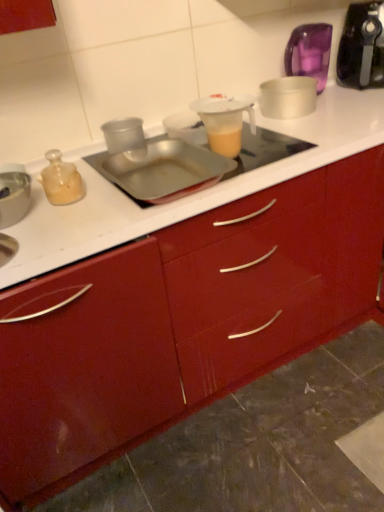
Locate an element on the screen. The image size is (384, 512). transparent plastic cup at center, which is counted as the 2th appliance, starting from the front is located at coordinates (126, 137).

The height and width of the screenshot is (512, 384). What do you see at coordinates (225, 121) in the screenshot?
I see `translucent plastic pitcher at center` at bounding box center [225, 121].

The image size is (384, 512). In order to click on black plastic blender at upper right in this screenshot , I will do `click(362, 47)`.

Considering the sizes of objects translucent purple container at upper right, positioned as the first appliance in right-to-left order, and black plastic blender at upper right in the image provided, who is thinner, translucent purple container at upper right, positioned as the first appliance in right-to-left order, or black plastic blender at upper right?

translucent purple container at upper right, positioned as the first appliance in right-to-left order, is thinner.

Is translucent purple container at upper right, acting as the first appliance starting from the top, with black plastic blender at upper right?

translucent purple container at upper right, acting as the first appliance starting from the top, and black plastic blender at upper right are not in contact.

Consider the image. Can we say translucent purple container at upper right, positioned as the first appliance in right-to-left order, lies outside black plastic blender at upper right?

Yes, translucent purple container at upper right, positioned as the first appliance in right-to-left order, is not within black plastic blender at upper right.

Looking at this image, is transparent plastic cup at center, acting as the second appliance starting from the bottom, to the left or to the right of white plastic container at upper right, the second appliance when ordered from top to bottom, in the image?

From the image, it's evident that transparent plastic cup at center, acting as the second appliance starting from the bottom, is to the left of white plastic container at upper right, the second appliance when ordered from top to bottom.

Locate an element on the screen. The width and height of the screenshot is (384, 512). the 1st appliance behind the transparent plastic cup at center, acting as the second appliance starting from the bottom, starting your count from the anchor is located at coordinates (288, 97).

In the scene shown: Does transparent plastic cup at center, acting as the third appliance starting from the back, contain white plastic container at upper right, the second appliance positioned from the right?

Definitely not — white plastic container at upper right, the second appliance positioned from the right, is not inside transparent plastic cup at center, acting as the third appliance starting from the back.

Does transparent plastic cup at center, which is counted as the 2th appliance, starting from the front, have a greater width compared to white plastic container at upper right, the second appliance when ordered from top to bottom?

Incorrect, the width of transparent plastic cup at center, which is counted as the 2th appliance, starting from the front, does not surpass that of white plastic container at upper right, the second appliance when ordered from top to bottom.

Considering the sizes of objects transparent plastic cup at center, acting as the third appliance starting from the back, and glossy red cabinet at center in the image provided, who is shorter, transparent plastic cup at center, acting as the third appliance starting from the back, or glossy red cabinet at center?

transparent plastic cup at center, acting as the third appliance starting from the back, is shorter.

Are transparent plastic cup at center, which is the third appliance in right-to-left order, and glossy red cabinet at center beside each other?

No, transparent plastic cup at center, which is the third appliance in right-to-left order, is not next to glossy red cabinet at center.

Is transparent plastic cup at center, placed as the third appliance when sorted from top to bottom, outside of glossy red cabinet at center?

Yes, transparent plastic cup at center, placed as the third appliance when sorted from top to bottom, is located beyond the bounds of glossy red cabinet at center.

There is a glossy red cabinet at center. At what (x,y) coordinates should I click in order to perform the action: click on the 1st appliance above it (from a real-world perspective). Please return your answer as a coordinate pair (x, y). The image size is (384, 512). Looking at the image, I should click on (126, 137).

Considering the points (301, 94) and (248, 104), which point is in front, point (301, 94) or point (248, 104)?

The point (248, 104) is more forward.

Considering the relative positions of white plastic container at upper right, which is counted as the 3th appliance, starting from the bottom, and translucent plastic pitcher at center in the image provided, is white plastic container at upper right, which is counted as the 3th appliance, starting from the bottom, to the left of translucent plastic pitcher at center from the viewer's perspective?

Incorrect, white plastic container at upper right, which is counted as the 3th appliance, starting from the bottom, is not on the left side of translucent plastic pitcher at center.

You are a GUI agent. You are given a task and a screenshot of the screen. Output one action in this format:
    pyautogui.click(x=<x>, y=<y>)
    Task: Click on the pitcher in front of the white plastic container at upper right, the second appliance positioned from the right
    The image size is (384, 512).
    Given the screenshot: What is the action you would take?
    pyautogui.click(x=225, y=121)

Can you confirm if white plastic container at upper right, the second appliance positioned from the right, is smaller than translucent plastic pitcher at center?

No.

Which of these two, metallic silver tray at center or black plastic blender at upper right, is wider?

metallic silver tray at center.

In the image, is metallic silver tray at center positioned in front of or behind black plastic blender at upper right?

metallic silver tray at center is positioned closer to the viewer than black plastic blender at upper right.

From the image's perspective, is metallic silver tray at center over black plastic blender at upper right?

Actually, metallic silver tray at center appears below black plastic blender at upper right in the image.

How distant is glossy red cabinet at center from metallic silver tray at center?

A distance of 15.31 inches exists between glossy red cabinet at center and metallic silver tray at center.

From a real-world perspective, is glossy red cabinet at center below metallic silver tray at center?

Indeed, from a real-world perspective, glossy red cabinet at center is positioned beneath metallic silver tray at center.

Considering the positions of objects glossy red cabinet at center and metallic silver tray at center in the image provided, who is more to the left, glossy red cabinet at center or metallic silver tray at center?

Positioned to the left is metallic silver tray at center.

Could you tell me if black plastic blender at upper right is turned towards glossy red cabinet at center?

No, black plastic blender at upper right is not oriented towards glossy red cabinet at center.

Is black plastic blender at upper right far from glossy red cabinet at center?

Actually, black plastic blender at upper right and glossy red cabinet at center are a little close together.

Which object is thinner, black plastic blender at upper right or glossy red cabinet at center?

black plastic blender at upper right is thinner.

Does point (337, 72) come closer to viewer compared to point (290, 322)?

No, it is not.

The height and width of the screenshot is (512, 384). I want to click on kitchen appliance above the translucent purple container at upper right, the 1th appliance positioned from the back (from a real-world perspective), so click(x=362, y=47).

From the transparent plastic cup at center, the second appliance when ordered from left to right, count 1st appliance to the right and point to it. Please provide its 2D coordinates.

[(288, 97)]

Estimate the real-world distances between objects in this image. Which object is closer to translucent purple container at upper right, the 4th appliance from the left, translucent plastic pitcher at center or metallic silver bowl at left, positioned as the 4th appliance in top-to-bottom order?

The object closer to translucent purple container at upper right, the 4th appliance from the left, is translucent plastic pitcher at center.

From the image, which object appears to be nearer to metallic silver bowl at left, marked as the 4th appliance in a right-to-left arrangement, glossy red cabinet at center or translucent purple container at upper right, which is counted as the fourth appliance, starting from the front?

glossy red cabinet at center is closer to metallic silver bowl at left, marked as the 4th appliance in a right-to-left arrangement.

From the image, which object appears to be nearer to glossy red cabinet at center, black plastic blender at upper right or white plastic container at upper right, the second appliance when ordered from top to bottom?

white plastic container at upper right, the second appliance when ordered from top to bottom, is positioned closer to the anchor glossy red cabinet at center.

Estimate the real-world distances between objects in this image. Which object is further from white plastic container at upper right, the second appliance when ordered from top to bottom, translucent plastic pitcher at center or black plastic blender at upper right?

translucent plastic pitcher at center lies further to white plastic container at upper right, the second appliance when ordered from top to bottom, than the other object.

Looking at the image, which one is located closer to transparent plastic cup at center, which is the third appliance in right-to-left order, white plastic container at upper right, acting as the 2th appliance starting from the back, or translucent purple container at upper right, the 4th appliance from the left?

The object closer to transparent plastic cup at center, which is the third appliance in right-to-left order, is white plastic container at upper right, acting as the 2th appliance starting from the back.

Considering their positions, is transparent plastic cup at center, acting as the third appliance starting from the back, positioned further to metallic silver bowl at left, marked as the 4th appliance in a right-to-left arrangement, than black plastic blender at upper right?

black plastic blender at upper right.

Considering their positions, is black plastic blender at upper right positioned further to white plastic container at upper right, the second appliance positioned from the right, than metallic silver tray at center?

Based on the image, metallic silver tray at center appears to be further to white plastic container at upper right, the second appliance positioned from the right.

Which object lies nearer to the anchor point glossy red cabinet at center, metallic silver tray at center or metallic silver bowl at left, which ranks as the 1th appliance in front-to-back order?

metallic silver tray at center lies closer to glossy red cabinet at center than the other object.

Where is `gas stove between metallic silver bowl at left, marked as the 4th appliance in a right-to-left arrangement, and white plastic container at upper right, which is counted as the 3th appliance, starting from the bottom, from left to right`? The image size is (384, 512). gas stove between metallic silver bowl at left, marked as the 4th appliance in a right-to-left arrangement, and white plastic container at upper right, which is counted as the 3th appliance, starting from the bottom, from left to right is located at coordinates (161, 168).

Identify the location of gas stove between glossy red cabinet at center and transparent plastic cup at center, the second appliance when ordered from left to right, in the front-back direction. This screenshot has width=384, height=512. (161, 168).

Locate an element on the screen. The height and width of the screenshot is (512, 384). kitchen appliance positioned between glossy red cabinet at center and white plastic container at upper right, acting as the 2th appliance starting from the back, from near to far is located at coordinates (362, 47).

You are a GUI agent. You are given a task and a screenshot of the screen. Output one action in this format:
    pyautogui.click(x=<x>, y=<y>)
    Task: Click on the appliance between metallic silver bowl at left, marked as the 4th appliance in a back-to-front arrangement, and translucent plastic pitcher at center, in the horizontal direction
    This screenshot has width=384, height=512.
    Given the screenshot: What is the action you would take?
    pyautogui.click(x=126, y=137)